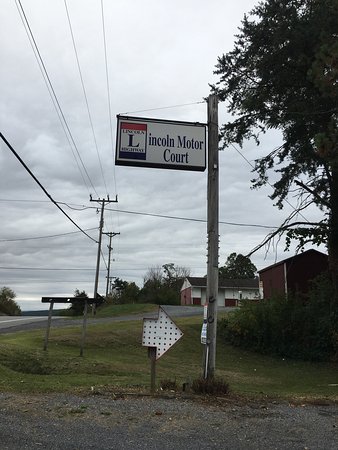
Image resolution: width=338 pixels, height=450 pixels. What are the coordinates of `white wall` in the screenshot? It's located at (234, 292).